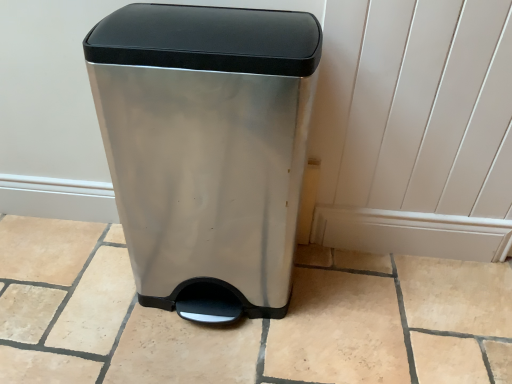
Where is `free spot to the right of satin silver trash can at center`? free spot to the right of satin silver trash can at center is located at coordinates (369, 304).